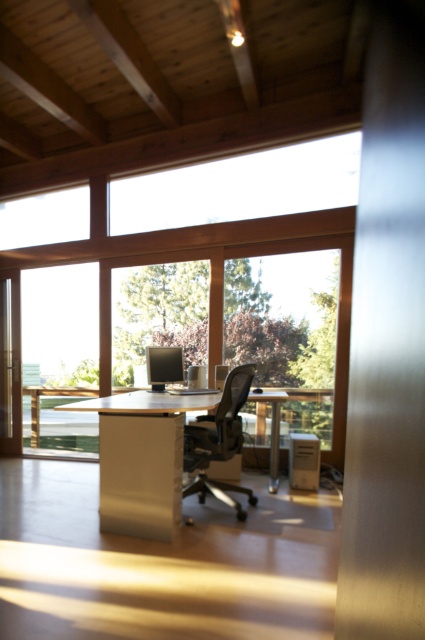
Does point (161, 298) come farther from viewer compared to point (215, 413)?

That is True.

Which of these two, clear glass window at center or white glossy computer desk at center, stands taller?

white glossy computer desk at center

Locate an element on the screen. clear glass window at center is located at coordinates (189, 316).

This screenshot has width=425, height=640. What do you see at coordinates (141, 458) in the screenshot?
I see `white glossy computer desk at center` at bounding box center [141, 458].

Where is `white glossy computer desk at center`? This screenshot has height=640, width=425. white glossy computer desk at center is located at coordinates (141, 458).

Who is shorter, clear glass window at center or matte black office chair at center?

With less height is clear glass window at center.

Does clear glass window at center have a smaller size compared to matte black office chair at center?

Yes, clear glass window at center is smaller than matte black office chair at center.

Between point (238, 282) and point (221, 486), which one is positioned in front?

Point (221, 486) is more forward.

The image size is (425, 640). I want to click on clear glass window at center, so click(189, 316).